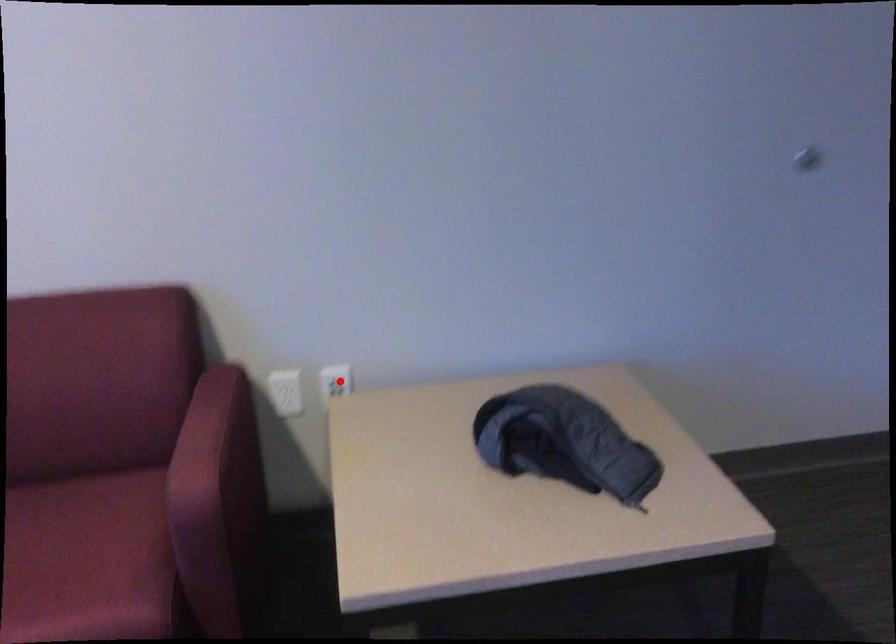
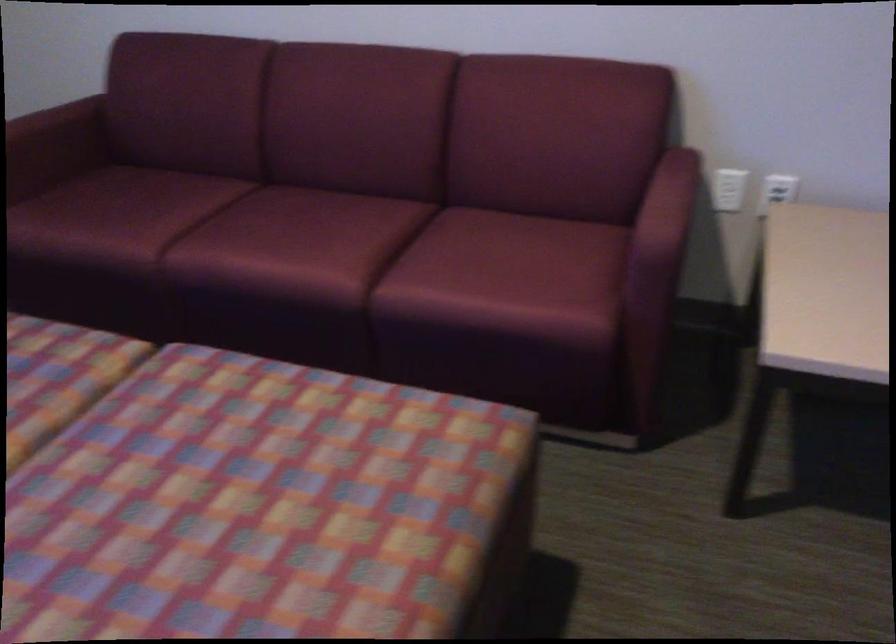
Where in the second image is the point corresponding to the highlighted location from the first image?

(777, 190)